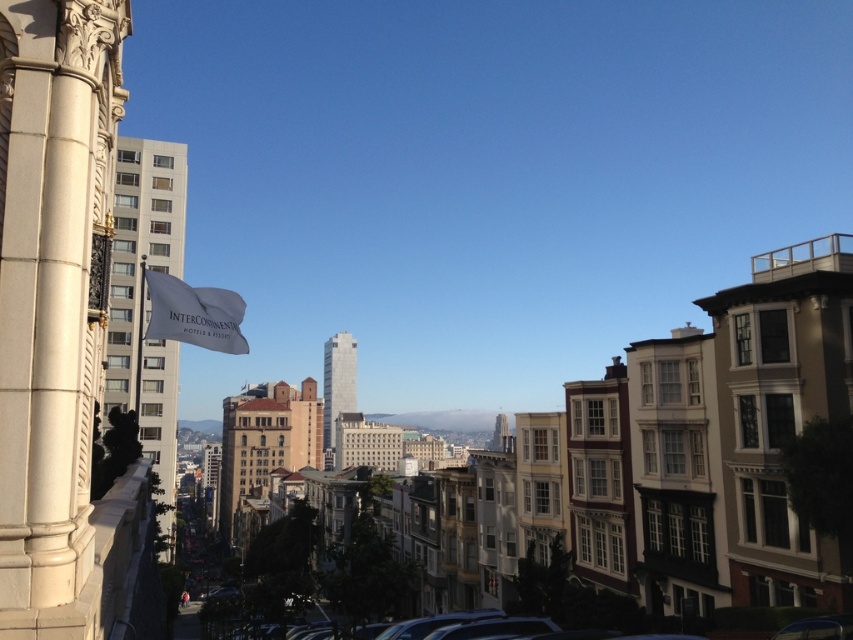
You are standing on a balcony overlooking the city and see the white stone column at left and the white fabric flag at upper left. Which object is closer to your left side?

The white fabric flag at upper left is more on the left side than the white stone column at left, so the white fabric flag at upper left is closer to your left side.

You are standing on a balcony overlooking the city and notice two points in the distance. The first point is located at coordinates point (55, 545) and the second at point (149, 300). Which of these points is closer to your vantage point?

Point (55, 545) is closer to the viewer than point (149, 300).

You are a maintenance worker who needs to reach the white fabric flag at upper left from the white stone column at left. The maintenance ladder you have is 25 feet long. Can you safely reach the flag using the ladder from the column?

The distance between the white stone column at left and the white fabric flag at upper left is 28.55 feet, which exceeds the 25 feet length of the ladder. Therefore, the ladder is too short to safely reach the flag from the column.